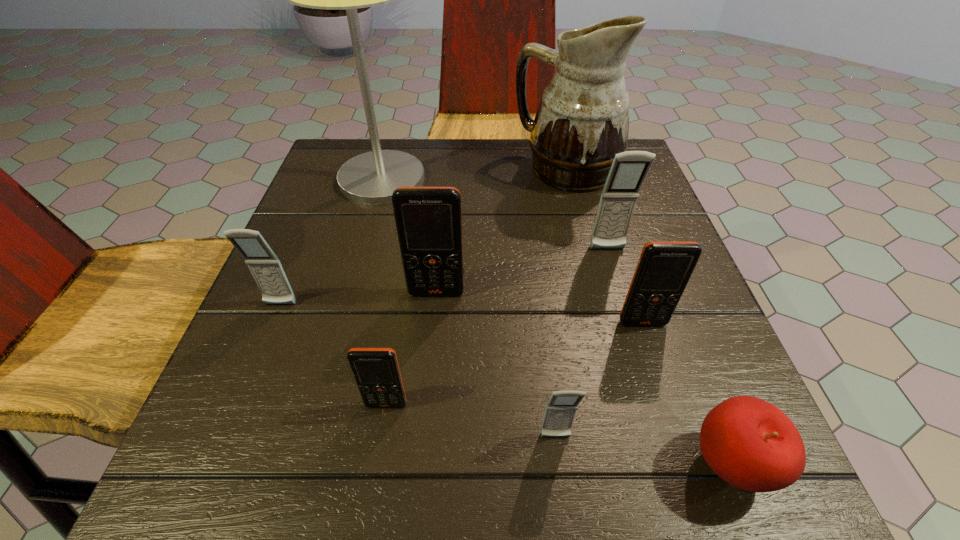
Identify the location of free space located 0.370m from the spout of the eighth shortest object. The width and height of the screenshot is (960, 540). (362, 169).

The image size is (960, 540). Find the location of `free space located on the front-facing side of the biggest gray cellular telephone`. free space located on the front-facing side of the biggest gray cellular telephone is located at coordinates (621, 297).

This screenshot has width=960, height=540. Find the location of `free space located on the screen of the farthest orange cellular telephone`. free space located on the screen of the farthest orange cellular telephone is located at coordinates (433, 330).

This screenshot has width=960, height=540. In order to click on vacant space situated 0.210m on the front-facing side of the third farthest cellular telephone in this screenshot , I will do pos(230,426).

The image size is (960, 540). What are the coordinates of `vacant space located 0.260m on the screen of the second biggest orange cellular telephone` in the screenshot? It's located at (697, 492).

The height and width of the screenshot is (540, 960). I want to click on free space located on the screen of the seventh farthest object, so click(x=380, y=443).

Identify the location of vacant region located 0.080m on the front-facing side of the nearest cellular telephone. (564, 507).

Locate an element on the screen. vacant space located on the back of the red apple is located at coordinates (681, 338).

Locate an element on the screen. The height and width of the screenshot is (540, 960). table lamp at the far edge is located at coordinates (371, 178).

Identify the location of pitcher situated at the far edge. (582, 122).